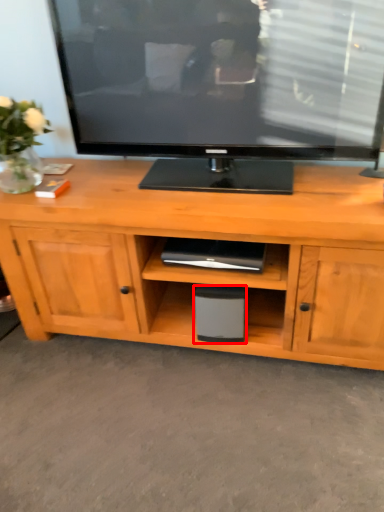
Question: From the image's perspective, considering the relative positions of speaker (annotated by the red box) and plant in the image provided, where is speaker (annotated by the red box) located with respect to the staircase?

Choices:
 (A) above
 (B) below

Answer: (B)